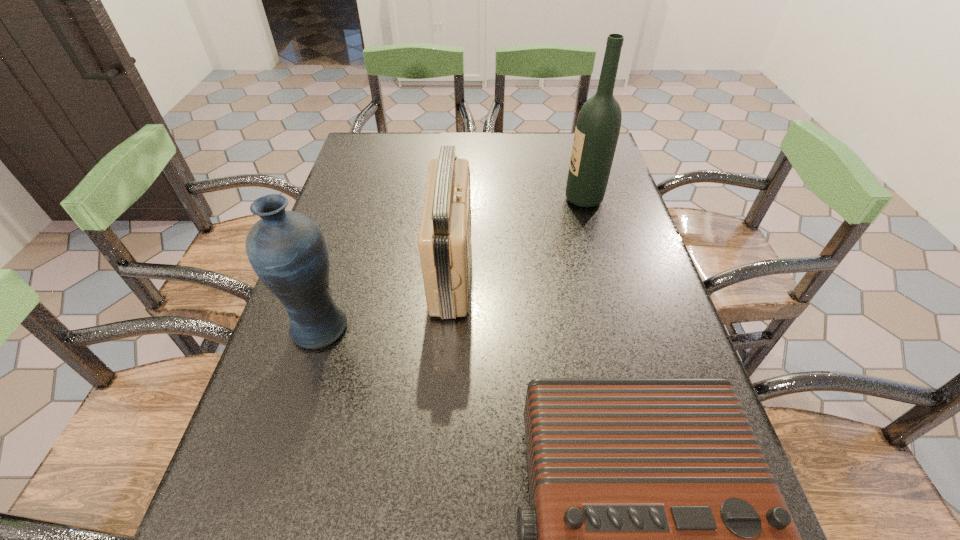
Locate an element on the screen. the farthest object is located at coordinates (597, 130).

Locate an element on the screen. The width and height of the screenshot is (960, 540). the tallest object is located at coordinates (597, 130).

Image resolution: width=960 pixels, height=540 pixels. Identify the location of the leftmost object. (287, 250).

The width and height of the screenshot is (960, 540). What are the coordinates of `the farther radio receiver` in the screenshot? It's located at (444, 240).

The image size is (960, 540). In order to click on the third tallest object in this screenshot , I will do `click(444, 240)`.

What are the coordinates of `vacant space located 0.090m on the labeled side of the wine bottle` in the screenshot? It's located at (532, 199).

Locate an element on the screen. blank area located on the labeled side of the wine bottle is located at coordinates (452, 199).

You are a GUI agent. You are given a task and a screenshot of the screen. Output one action in this format:
    pyautogui.click(x=<x>, y=<y>)
    Task: Click on the free region located on the labeled side of the wine bottle
    
    Given the screenshot: What is the action you would take?
    pyautogui.click(x=503, y=199)

The width and height of the screenshot is (960, 540). I want to click on free space located 0.210m on the front of the leftmost object, so click(x=277, y=461).

Where is `vacant space located 0.240m on the front-facing side of the left radio receiver`? Image resolution: width=960 pixels, height=540 pixels. vacant space located 0.240m on the front-facing side of the left radio receiver is located at coordinates (575, 273).